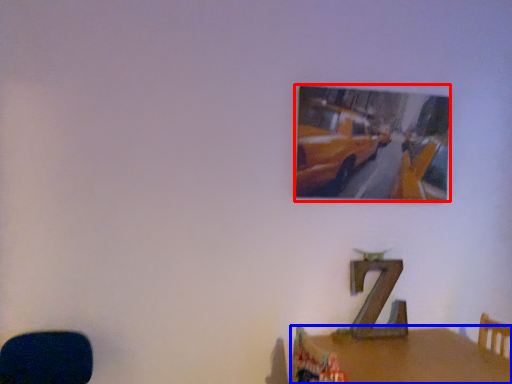
Question: Among these objects, which one is farthest to the camera, picture frame (highlighted by a red box) or table (highlighted by a blue box)?

Choices:
 (A) picture frame
 (B) table

Answer: (A)